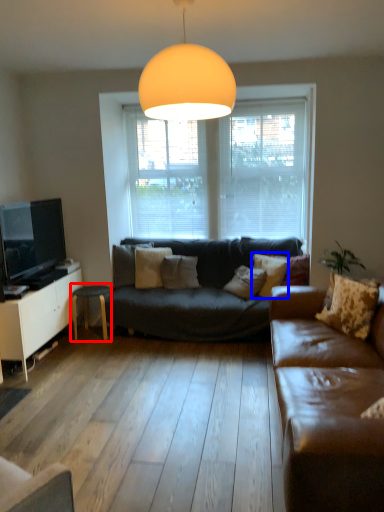
Question: Which point is closer to the camera, table (highlighted by a red box) or pillow (highlighted by a blue box)?

Choices:
 (A) table
 (B) pillow

Answer: (B)